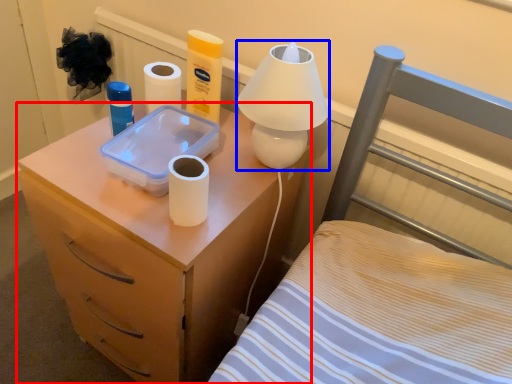
Question: Among these objects, which one is farthest to the camera, nightstand (highlighted by a red box) or table lamp (highlighted by a blue box)?

Choices:
 (A) nightstand
 (B) table lamp

Answer: (B)